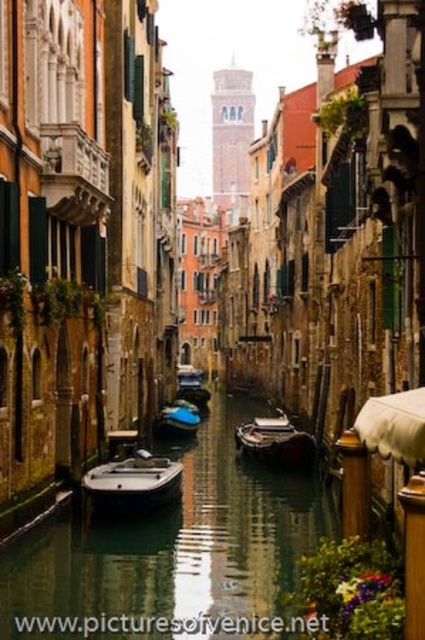
Question: Which object appears closest to the camera in this image?

Choices:
 (A) blue glossy boat at center
 (B) wooden polished boat at center
 (C) white matte boat at center
 (D) green glossy waterway at center

Answer: (D)

Question: Is wooden polished boat at center thinner than matte black boat at center?

Choices:
 (A) no
 (B) yes

Answer: (A)

Question: Where is green glossy waterway at center located in relation to white matte boat at center in the image?

Choices:
 (A) left
 (B) right

Answer: (B)

Question: Is wooden polished boat at center closer to the viewer compared to blue glossy boat at center?

Choices:
 (A) no
 (B) yes

Answer: (B)

Question: Which object is closer to the camera taking this photo?

Choices:
 (A) wooden polished boat at center
 (B) white matte boat at center
 (C) matte black boat at center
 (D) green glossy waterway at center

Answer: (D)

Question: Which of the following is the closest to the observer?

Choices:
 (A) (167, 419)
 (B) (198, 380)

Answer: (A)